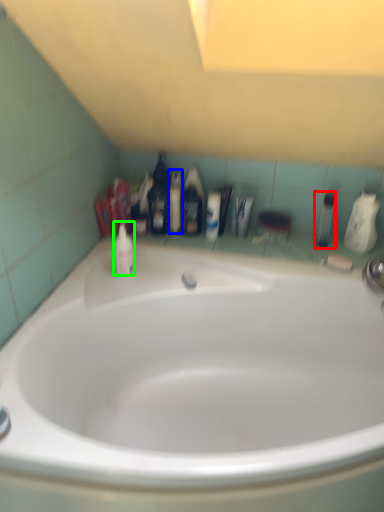
Question: Considering the real-world distances, which object is closest to mouthwash (highlighted by a red box)? mouthwash (highlighted by a blue box) or mouthwash (highlighted by a green box).

Choices:
 (A) mouthwash
 (B) mouthwash

Answer: (A)